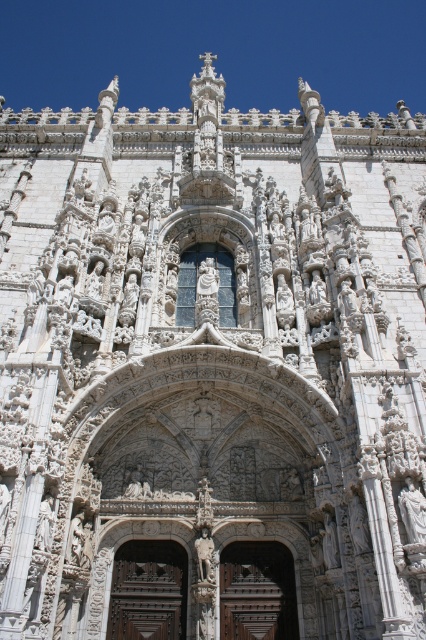
Question: Considering the relative positions of brown carved wood door at center and brown wooden door at center in the image provided, where is brown carved wood door at center located with respect to brown wooden door at center?

Choices:
 (A) left
 (B) right

Answer: (A)

Question: Does brown carved wood door at center have a greater width compared to brown wooden door at center?

Choices:
 (A) no
 (B) yes

Answer: (A)

Question: Which point is closer to the camera?

Choices:
 (A) (172, 541)
 (B) (281, 636)

Answer: (B)

Question: Observing the image, what is the correct spatial positioning of brown carved wood door at center in reference to brown wooden door at center?

Choices:
 (A) above
 (B) below

Answer: (A)

Question: Which point appears farthest from the camera in this image?

Choices:
 (A) [256, 592]
 (B) [181, 614]

Answer: (A)